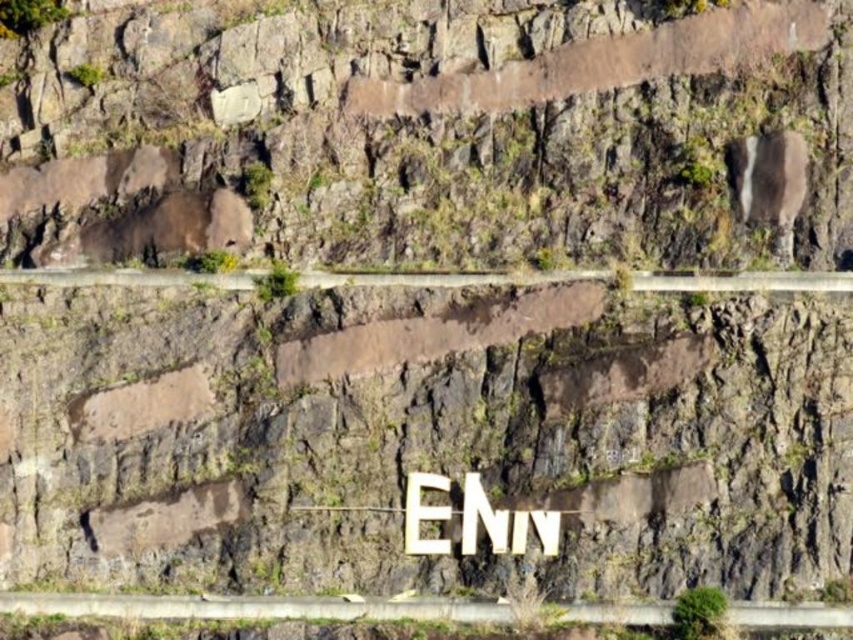
Is brown rock at center wider than white wooden sign at center?

Yes.

Between brown rock at center and white wooden sign at center, which one is positioned lower?

white wooden sign at center is below.

Who is more distant from viewer, (x=9, y=100) or (x=419, y=545)?

The point (x=9, y=100) is more distant.

Identify the location of brown rock at center. (433, 134).

Is brown rock at center below gray concrete path at lower center?

Incorrect, brown rock at center is not positioned below gray concrete path at lower center.

This screenshot has height=640, width=853. I want to click on brown rock at center, so click(433, 134).

Image resolution: width=853 pixels, height=640 pixels. I want to click on brown rock at center, so click(x=433, y=134).

Does gray concrete path at lower center appear under white wooden sign at center?

Correct, gray concrete path at lower center is located below white wooden sign at center.

Is gray concrete path at lower center to the right of white wooden sign at center from the viewer's perspective?

Incorrect, gray concrete path at lower center is not on the right side of white wooden sign at center.

Between point (405, 604) and point (450, 548), which one is positioned in front?

Point (405, 604) is more forward.

This screenshot has height=640, width=853. Find the location of `gray concrete path at lower center`. gray concrete path at lower center is located at coordinates click(254, 608).